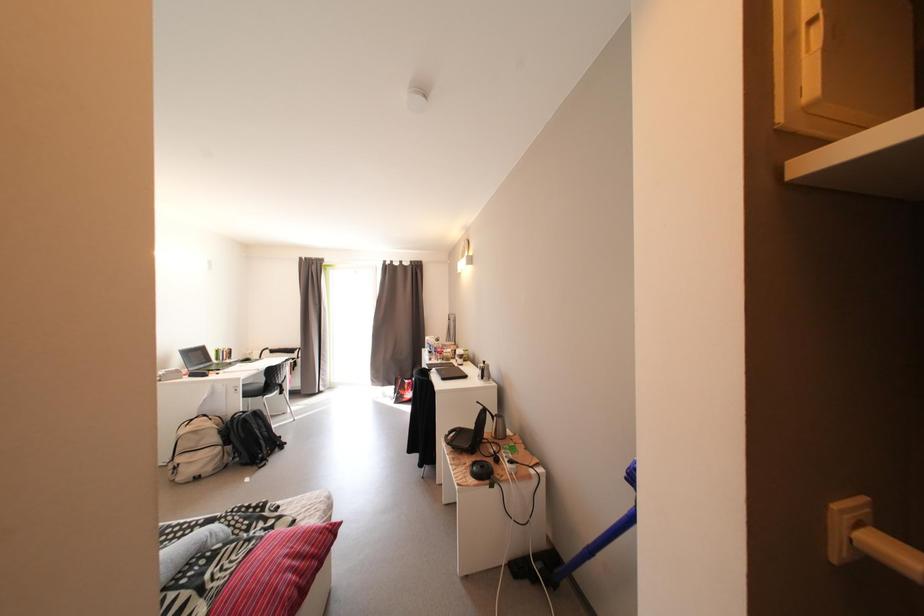
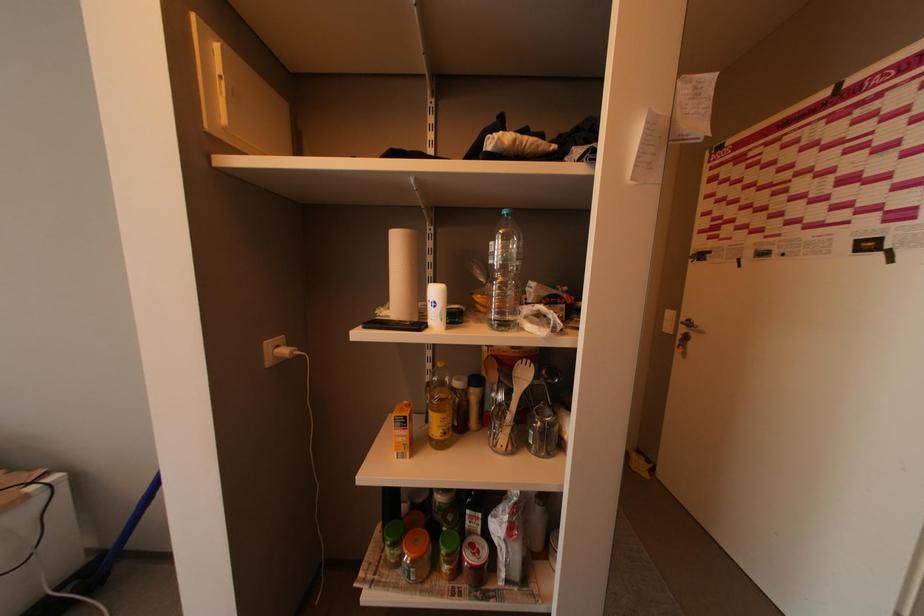
Question: How did the camera likely rotate?

Choices:
 (A) Left
 (B) Right
 (C) Up
 (D) Down

Answer: (B)